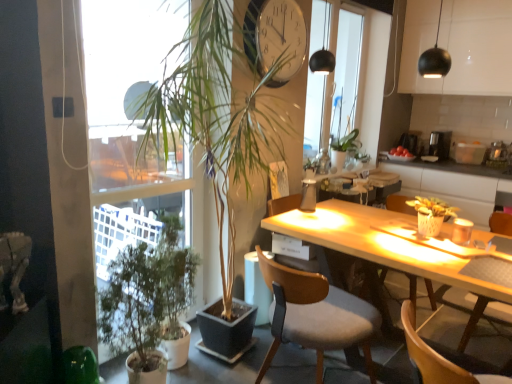
The height and width of the screenshot is (384, 512). What do you see at coordinates (322, 57) in the screenshot?
I see `black matte lamp at upper center, the second lamp when ordered from right to left` at bounding box center [322, 57].

Measure the distance between point [335,62] and camera.

8.69 feet.

The height and width of the screenshot is (384, 512). Describe the element at coordinates (226, 104) in the screenshot. I see `green matte plant at left, which ranks as the second houseplant in left-to-right order` at that location.

Find the location of `wooden chair at lower right, acting as the first chair starting from the front`. wooden chair at lower right, acting as the first chair starting from the front is located at coordinates (437, 358).

Measure the distance between transparent glass window at center and camera.

transparent glass window at center is 3.34 meters away from camera.

In order to face wooden chair at center, which appears as the 3th chair when viewed from the front, should I rotate leftwards or rightwards?

Turn right by 7.642 degrees to look at wooden chair at center, which appears as the 3th chair when viewed from the front.

Where is `translucent glass bottle at table center, which ranks as the 1th bottle in front-to-back order`? translucent glass bottle at table center, which ranks as the 1th bottle in front-to-back order is located at coordinates (308, 196).

Where is `black matte lamp at upper center, the second lamp when ordered from right to left`? Image resolution: width=512 pixels, height=384 pixels. black matte lamp at upper center, the second lamp when ordered from right to left is located at coordinates (322, 57).

Is green matte plant at left, which is counted as the 1th houseplant, starting from the left, in contact with black matte lamp at upper center, positioned as the 2th lamp in front-to-back order?

No, green matte plant at left, which is counted as the 1th houseplant, starting from the left, is not with black matte lamp at upper center, positioned as the 2th lamp in front-to-back order.

From a real-world perspective, which is physically below, green matte plant at left, which is counted as the 1th houseplant, starting from the left, or black matte lamp at upper center, which is counted as the 1th lamp, starting from the left?

From a 3D spatial view, green matte plant at left, which is counted as the 1th houseplant, starting from the left, is below.

In terms of width, does green matte plant at left, the 3th houseplant viewed from the right, look wider or thinner when compared to black matte lamp at upper center, arranged as the first lamp when viewed from the back?

Clearly, green matte plant at left, the 3th houseplant viewed from the right, has more width compared to black matte lamp at upper center, arranged as the first lamp when viewed from the back.

The image size is (512, 384). Identify the location of the 2nd houseplant to the left when counting from the black matte lamp at upper center, the second lamp when ordered from right to left. (148, 298).

From the image's perspective, is wooden chair at center, which appears as the 3th chair when viewed from the front, located above green matte plant at left, which is the 2th houseplant from right to left?

Incorrect, from the image's perspective, wooden chair at center, which appears as the 3th chair when viewed from the front, is lower than green matte plant at left, which is the 2th houseplant from right to left.

Between point (293, 197) and point (264, 76), which one is positioned in front?

The point (264, 76) is closer to the camera.

Is wooden chair at center, which appears as the 3th chair when viewed from the front, next to green matte plant at left, which is the 2th houseplant from right to left?

No, wooden chair at center, which appears as the 3th chair when viewed from the front, is not with green matte plant at left, which is the 2th houseplant from right to left.

Is wooden chair at center, the first chair when ordered from back to front, taller or shorter than green matte plant at left, which ranks as the second houseplant in left-to-right order?

In the image, wooden chair at center, the first chair when ordered from back to front, appears to be shorter than green matte plant at left, which ranks as the second houseplant in left-to-right order.

Is black matte lamp at upper center, positioned as the 2th lamp in front-to-back order, inside or outside of matte black sphere at upper right, the second lamp positioned from the back?

black matte lamp at upper center, positioned as the 2th lamp in front-to-back order, cannot be found inside matte black sphere at upper right, the second lamp positioned from the back.

Between point (320, 65) and point (436, 61), which one is positioned behind?

The point (320, 65) is farther from the camera.

This screenshot has width=512, height=384. I want to click on lamp above the matte black sphere at upper right, positioned as the first lamp in front-to-back order (from the image's perspective), so click(322, 57).

Which point is more distant from viewer, (x=111, y=321) or (x=314, y=195)?

Positioned behind is point (x=314, y=195).

From a real-world perspective, between green matte plant at left, which is counted as the 1th houseplant, starting from the left, and translucent glass bottle at table center, the 1th bottle ordered from the bottom, who is vertically lower?

green matte plant at left, which is counted as the 1th houseplant, starting from the left.

From the image's perspective, who appears lower, green matte plant at left, which is counted as the 1th houseplant, starting from the left, or translucent glass bottle at table center, the first bottle from the left?

green matte plant at left, which is counted as the 1th houseplant, starting from the left, appears lower in the image.

How far apart are green matte plant at left, which is counted as the 1th houseplant, starting from the left, and translucent glass bottle at table center, which ranks as the 1th bottle in front-to-back order?

green matte plant at left, which is counted as the 1th houseplant, starting from the left, and translucent glass bottle at table center, which ranks as the 1th bottle in front-to-back order, are 1.32 meters apart from each other.

Could you measure the distance between black plastic coffee maker at upper right and black matte lamp at upper center, positioned as the 2th lamp in front-to-back order?

A distance of 2.16 meters exists between black plastic coffee maker at upper right and black matte lamp at upper center, positioned as the 2th lamp in front-to-back order.

Based on the photo, what's the angular difference between black plastic coffee maker at upper right and black matte lamp at upper center, the second lamp when ordered from right to left,'s facing directions?

5.76 degrees separate the facing orientations of black plastic coffee maker at upper right and black matte lamp at upper center, the second lamp when ordered from right to left.

Consider the image. Which object is positioned more to the left, black plastic coffee maker at upper right or black matte lamp at upper center, the second lamp when ordered from right to left?

From the viewer's perspective, black matte lamp at upper center, the second lamp when ordered from right to left, appears more on the left side.

Is black plastic coffee maker at upper right wider than black matte lamp at upper center, which is counted as the 1th lamp, starting from the left?

Indeed, black plastic coffee maker at upper right has a greater width compared to black matte lamp at upper center, which is counted as the 1th lamp, starting from the left.

Is point (218, 150) less distant than point (307, 275)?

No.

Which of these two, green matte plant at left, which is the 2th houseplant from right to left, or wooden chair with fabric cushion at center, the 2th chair when ordered from front to back, is wider?

With larger width is green matte plant at left, which is the 2th houseplant from right to left.

Considering the relative positions of green matte plant at left, which ranks as the second houseplant in left-to-right order, and wooden chair with fabric cushion at center, placed as the 2th chair when sorted from back to front, in the image provided, is green matte plant at left, which ranks as the second houseplant in left-to-right order, to the right of wooden chair with fabric cushion at center, placed as the 2th chair when sorted from back to front, from the viewer's perspective?

In fact, green matte plant at left, which ranks as the second houseplant in left-to-right order, is to the left of wooden chair with fabric cushion at center, placed as the 2th chair when sorted from back to front.

From the image's perspective, which one is positioned lower, green matte plant at left, which is the 2th houseplant from right to left, or wooden chair with fabric cushion at center, placed as the 2th chair when sorted from back to front?

wooden chair with fabric cushion at center, placed as the 2th chair when sorted from back to front, is shown below in the image.

Which point is more distant from viewer, (298, 306) or (223, 279)?

The point (223, 279) is farther.

Is wooden chair with fabric cushion at center, placed as the 2th chair when sorted from back to front, positioned beyond the bounds of green matte plant at left, which ranks as the second houseplant in left-to-right order?

Indeed, wooden chair with fabric cushion at center, placed as the 2th chair when sorted from back to front, is completely outside green matte plant at left, which ranks as the second houseplant in left-to-right order.

Is wooden chair with fabric cushion at center, placed as the 2th chair when sorted from back to front, bigger than green matte plant at left, which ranks as the second houseplant in left-to-right order?

No, wooden chair with fabric cushion at center, placed as the 2th chair when sorted from back to front, is not bigger than green matte plant at left, which ranks as the second houseplant in left-to-right order.

From a real-world perspective, count 3rd houseplants downward from the black matte lamp at upper center, the second lamp when ordered from right to left, and point to it. Please provide its 2D coordinates.

[(148, 298)]

From the image's perspective, which houseplant is the 2nd one above the wooden chair at center, which appears as the 3th chair when viewed from the front? Please provide its 2D coordinates.

[(226, 104)]

Estimate the real-world distances between objects in this image. Which object is further from green matte plant at right, the 1th houseplant viewed from the right, matte black sphere at upper right, positioned as the first lamp in front-to-back order, or black matte lamp at upper center, the second lamp when ordered from right to left?

black matte lamp at upper center, the second lamp when ordered from right to left, is further to green matte plant at right, the 1th houseplant viewed from the right.

Based on their spatial positions, is green matte plant at left, which ranks as the second houseplant in left-to-right order, or metallic clock at upper center closer to green matte plant at left, the 3th houseplant viewed from the right?

The object closer to green matte plant at left, the 3th houseplant viewed from the right, is green matte plant at left, which ranks as the second houseplant in left-to-right order.

Which object lies nearer to the anchor point black plastic coffee maker at upper right, transparent glass window at center or metallic clock at upper center?

transparent glass window at center.

Looking at the image, which one is located closer to metallic clock at upper center, matte black sphere at upper right, positioned as the first lamp in front-to-back order, or black matte lamp at upper center, the second lamp when ordered from right to left?

Based on the image, black matte lamp at upper center, the second lamp when ordered from right to left, appears to be nearer to metallic clock at upper center.

When comparing their distances from metallic clock at upper center, does matte black sphere at upper right, which ranks as the 2th lamp in left-to-right order, or green matte plant at right, which ranks as the third houseplant in left-to-right order, seem further?

green matte plant at right, which ranks as the third houseplant in left-to-right order, is positioned further to the anchor metallic clock at upper center.

Estimate the real-world distances between objects in this image. Which object is further from translucent glass bottle at table center, the 1th bottle ordered from the bottom, metallic clock at upper center or matte black sphere at upper right, positioned as the first lamp in front-to-back order?

Based on the image, matte black sphere at upper right, positioned as the first lamp in front-to-back order, appears to be further to translucent glass bottle at table center, the 1th bottle ordered from the bottom.

Based on their spatial positions, is black matte lamp at upper center, which is counted as the 1th lamp, starting from the left, or black plastic coffee maker at upper right further from green matte plant at left, which is the 2th houseplant from right to left?

Among the two, black plastic coffee maker at upper right is located further to green matte plant at left, which is the 2th houseplant from right to left.

Looking at the image, which one is located closer to wooden chair at center, which appears as the 3th chair when viewed from the front, black plastic coffee maker at upper right or green matte plant at right, which ranks as the third houseplant in left-to-right order?

green matte plant at right, which ranks as the third houseplant in left-to-right order, lies closer to wooden chair at center, which appears as the 3th chair when viewed from the front, than the other object.

Locate an element on the screen. The width and height of the screenshot is (512, 384). bottle located between green matte plant at left, which ranks as the second houseplant in left-to-right order, and translucent glass bottle at center, the second bottle when ordered from front to back, in the depth direction is located at coordinates (308, 196).

Locate an element on the screen. clock positioned between wooden chair with fabric cushion at center, placed as the 2th chair when sorted from back to front, and translucent glass bottle at center, the second bottle positioned from the left, from near to far is located at coordinates (275, 37).

Where is `houseplant located between green matte plant at left, the 3th houseplant viewed from the right, and green matte plant at right, the 1th houseplant viewed from the right, in the left-right direction`? The width and height of the screenshot is (512, 384). houseplant located between green matte plant at left, the 3th houseplant viewed from the right, and green matte plant at right, the 1th houseplant viewed from the right, in the left-right direction is located at coordinates (226, 104).

The image size is (512, 384). Identify the location of window screen between wooden chair with fabric cushion at center, placed as the 2th chair when sorted from back to front, and translucent glass bottle at center, the second bottle positioned from the left, along the z-axis. click(333, 74).